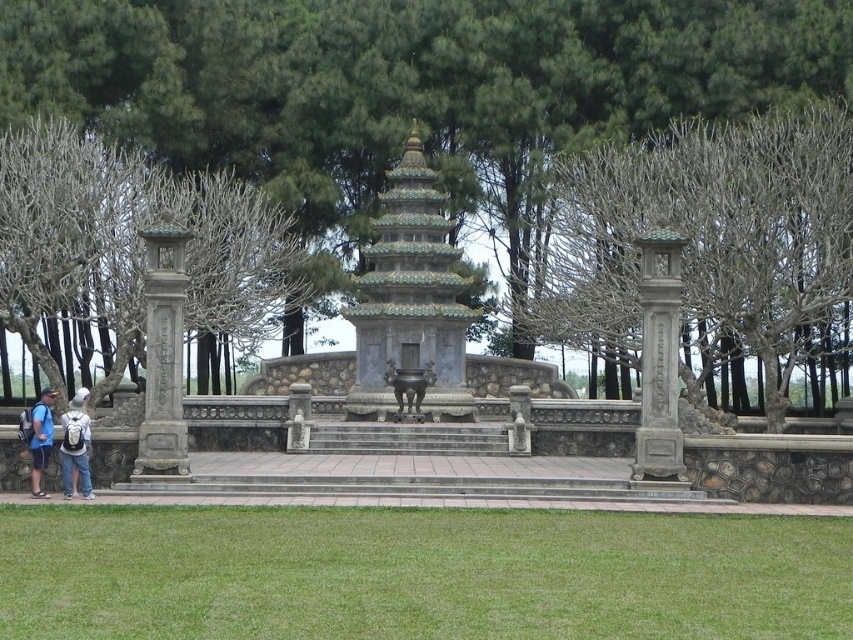
Consider the image. You are standing at the lower left corner of the scene and want to place a picnic blanket on the green grass at lower center. The denim jacket at lower left is in your way. Can you move the jacket to reach the grass?

The green grass at lower center is 20.11 meters away from the denim jacket at lower left. Since the distance is quite large, moving the jacket would not be necessary as you can easily walk around it to reach the grass.

You are standing at the entrance of the pagoda and see the gray stone pillar at right and the denim shorts at lower left. Which object is located to the right of the other?

The gray stone pillar at right is positioned on the right side of denim shorts at lower left, so the gray stone pillar at right is to the right of the denim shorts at lower left.

You are standing at the entrance of the pagoda and want to place a small decorative rock at the exact center of the green grass at lower center. According to the coordinates provided, where should you place the rock?

The exact center of the green grass at lower center is at coordinates point (416, 573), so you should place the rock there.